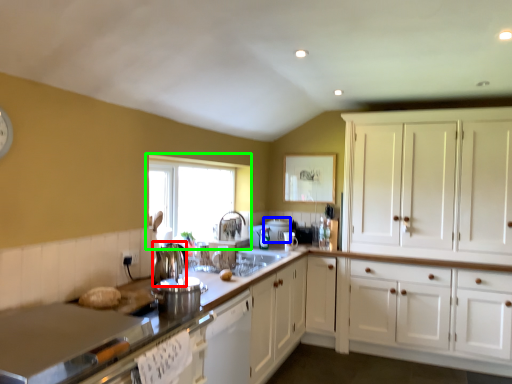
Question: Based on their relative distances, which object is farther from appliance (highlighted by a red box)? Choose from appliance (highlighted by a blue box) and window (highlighted by a green box).

Choices:
 (A) appliance
 (B) window

Answer: (A)